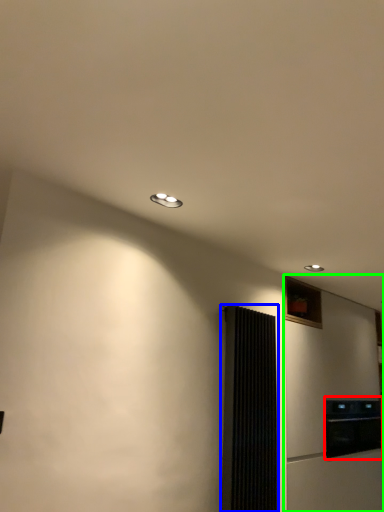
Question: Which object is positioned farthest from appliance (highlighted by a red box)? Select from screen door (highlighted by a blue box) and fridge (highlighted by a green box).

Choices:
 (A) screen door
 (B) fridge

Answer: (A)